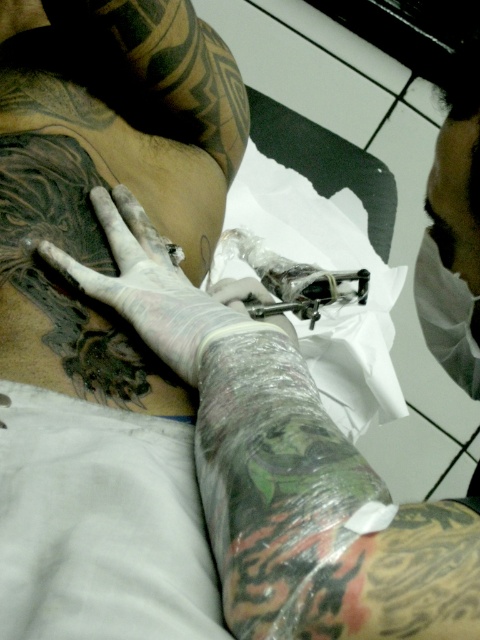
You are a tattoo artist observing the arm with the white latex glove at center and the clear plastic glove at center. Which glove is located to the left of the other?

The white latex glove at center is positioned on the left side of clear plastic glove at center.

You are a tattoo artist observing the arm with the white latex glove at upper center and the clear plastic glove at center. Which glove is taller?

The white latex glove at upper center is taller than the clear plastic glove at center.